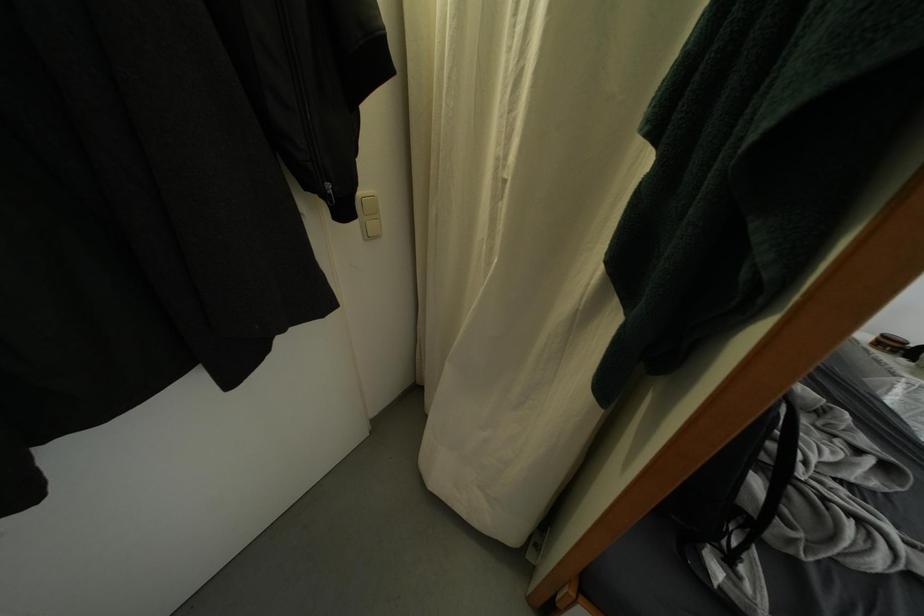
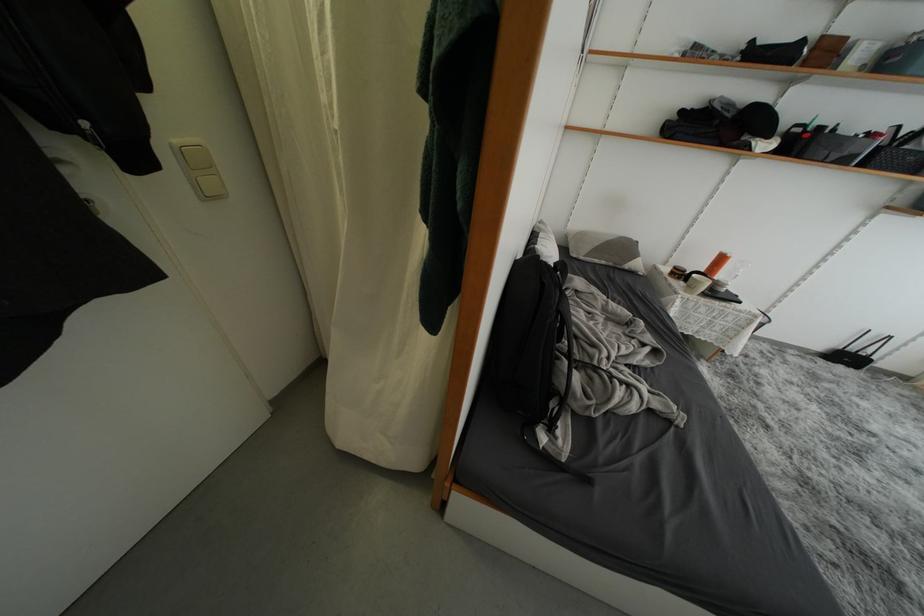
What movement of the cameraman would produce the second image?

The cameraman walked toward right, backward.